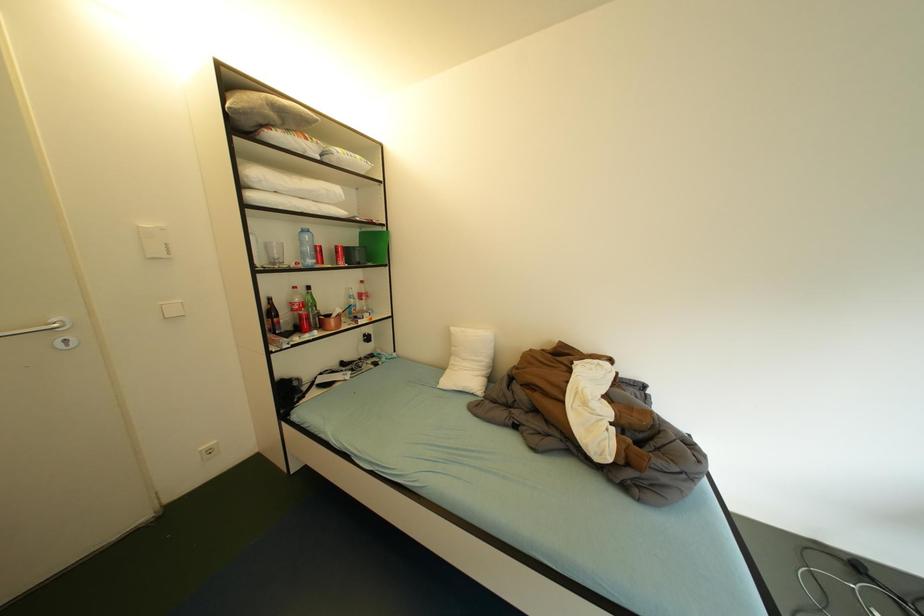
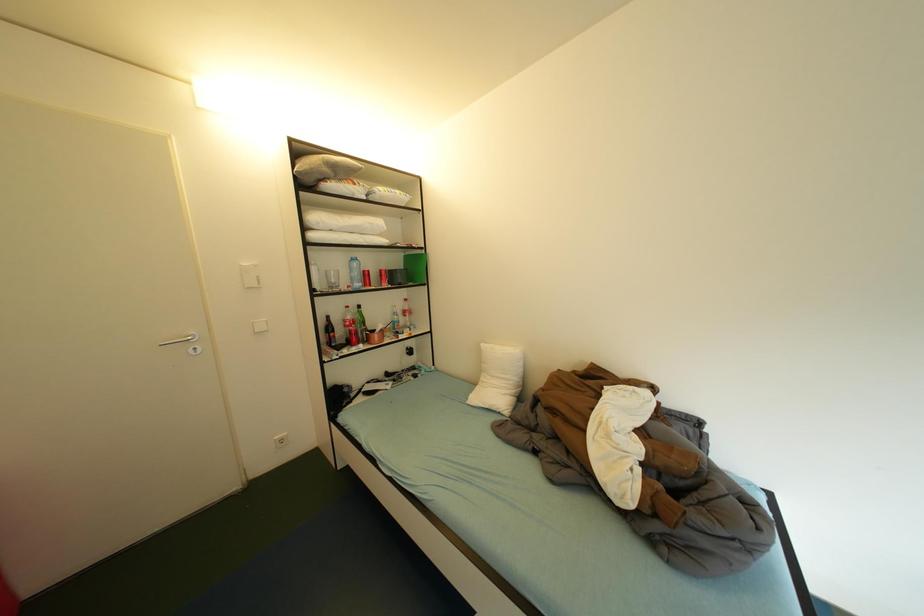
Question: Based on the continuous images, in which direction is the camera rotating? Reply with the corresponding letter.

Choices:
 (A) Left
 (B) Right
 (C) Up
 (D) Down

Answer: (A)